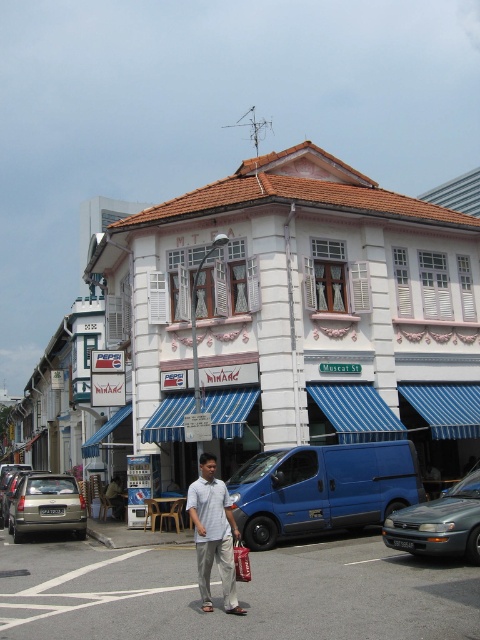
You are standing at the camera position and want to reach point (409,454). Is the distance less than 50 feet?

The distance between point (409,454) and the camera is 49.35 feet, so yes, the distance is less than 50 feet.

You are a pedestrian standing at the corner of the street. You see a silver metallic sedan at lower left and a red fabric shopping bag at center. Which object is closer to the ground?

The silver metallic sedan at lower left is located below the red fabric shopping bag at center, so it is closer to the ground.